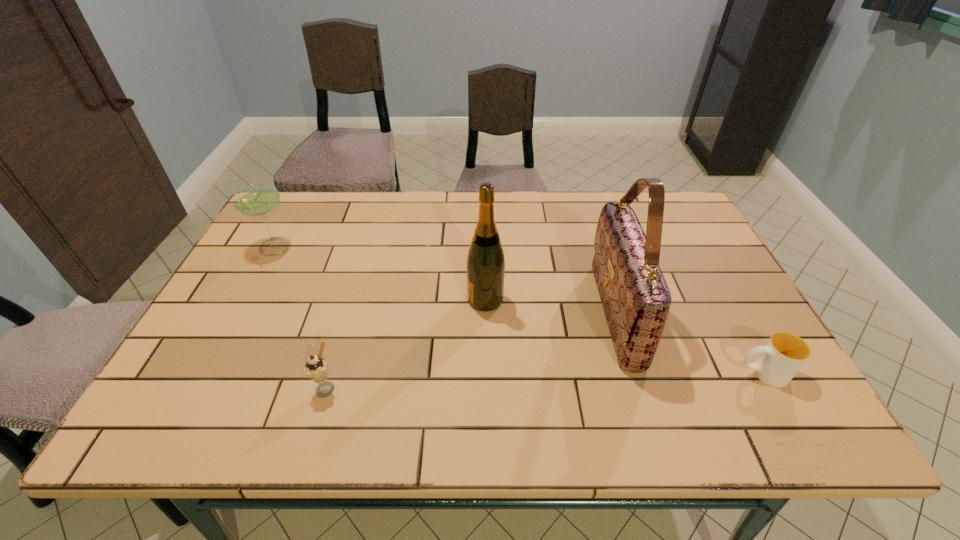
Where is `object that is at the near edge`? object that is at the near edge is located at coordinates (316, 367).

Identify the location of object present at the left edge. (260, 199).

Identify the location of object that is positioned at the right edge. (780, 359).

The height and width of the screenshot is (540, 960). Find the location of `object present at the far left corner`. object present at the far left corner is located at coordinates (260, 199).

Find the location of a particular element. vacant space at the far edge is located at coordinates (566, 218).

In the image, there is a desktop. Identify the location of vacant space at the near edge. (499, 398).

At what (x,y) coordinates should I click in order to perform the action: click on vacant space at the left edge of the desktop. Please return your answer as a coordinate pair (x, y). This screenshot has height=540, width=960. Looking at the image, I should click on (267, 316).

Identify the location of free space at the right edge of the desktop. Image resolution: width=960 pixels, height=540 pixels. (684, 306).

The image size is (960, 540). What are the coordinates of `free space at the far left corner` in the screenshot? It's located at (289, 215).

This screenshot has width=960, height=540. I want to click on free region at the near left corner, so click(x=171, y=432).